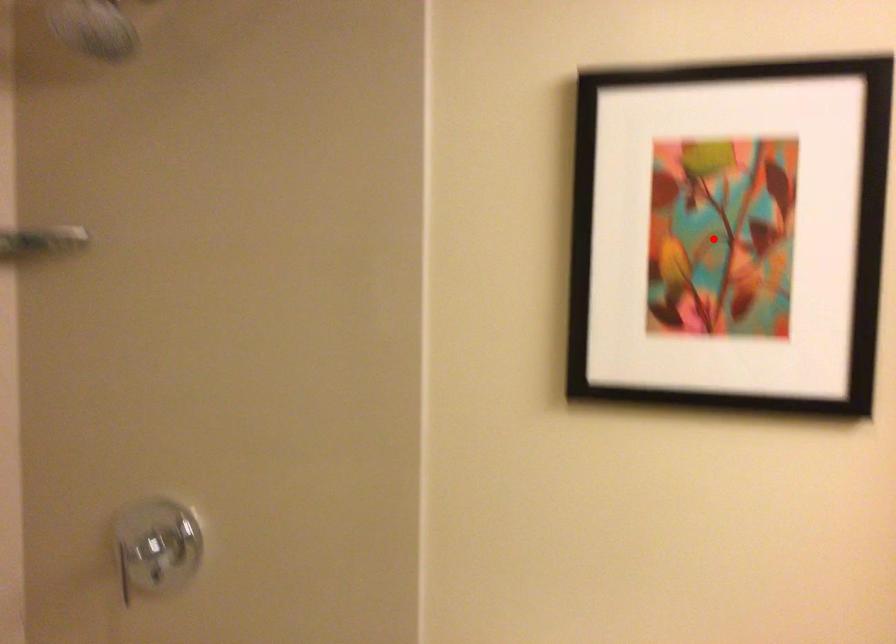
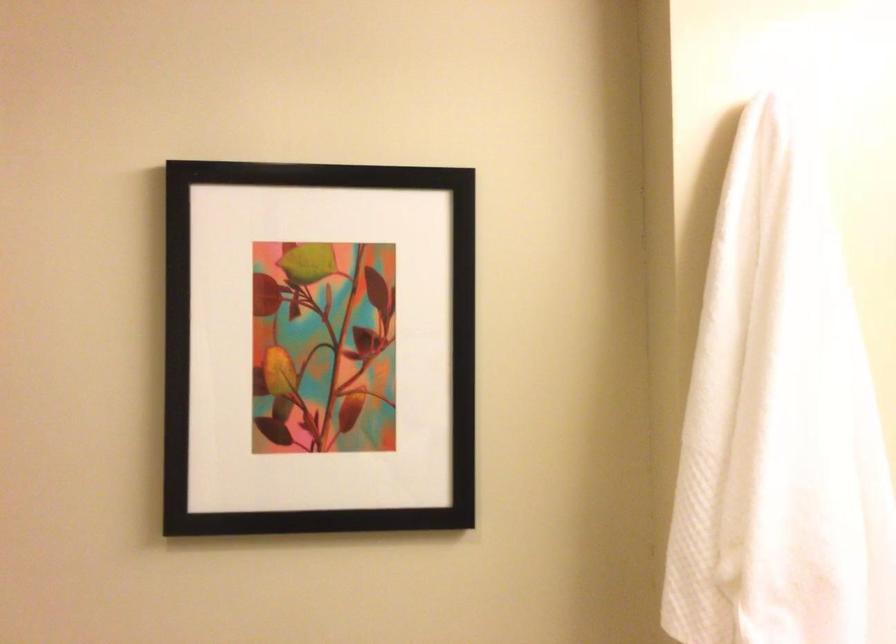
Locate, in the second image, the point that corresponds to the highlighted location in the first image.

(317, 348)